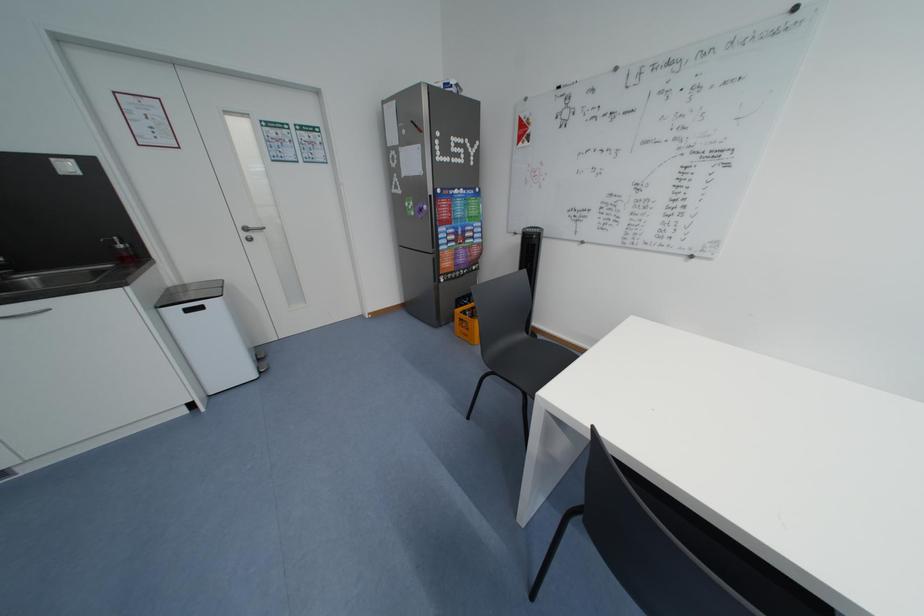
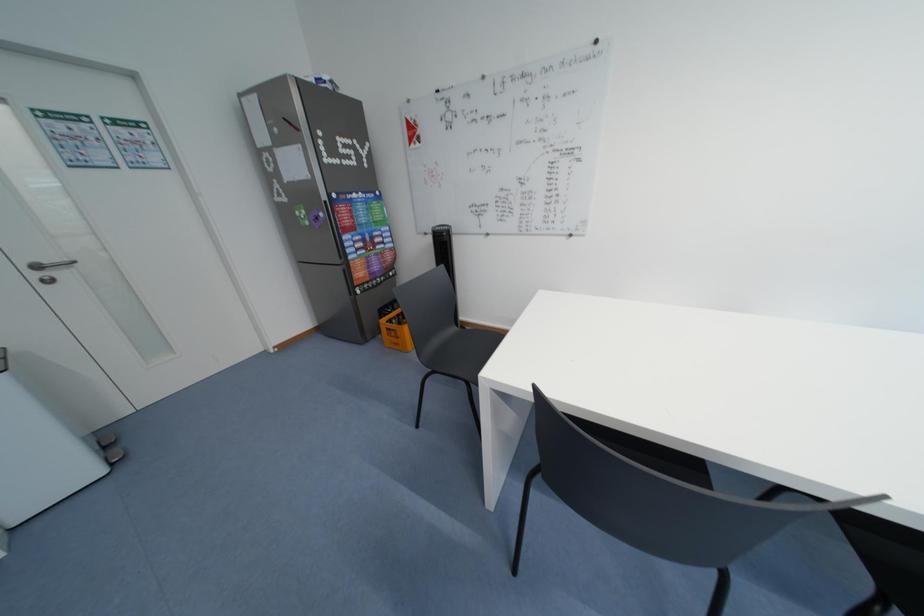
The images are taken continuously from a first-person perspective. In which direction are you moving?

The movement direction of the cameraman is left, forward.